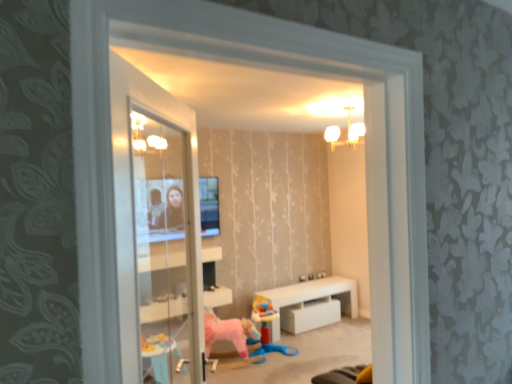
Question: Is white glossy table at center with pink fabric horse at center?

Choices:
 (A) no
 (B) yes

Answer: (A)

Question: Can you confirm if white glossy table at center is wider than pink fabric horse at center?

Choices:
 (A) yes
 (B) no

Answer: (A)

Question: Can you confirm if white glossy table at center is thinner than pink fabric horse at center?

Choices:
 (A) no
 (B) yes

Answer: (A)

Question: Would you say pink fabric horse at center is part of white glossy table at center's contents?

Choices:
 (A) yes
 (B) no

Answer: (B)

Question: Does white glossy table at center lie behind pink fabric horse at center?

Choices:
 (A) no
 (B) yes

Answer: (B)

Question: Is white glossy table at center taller than pink fabric horse at center?

Choices:
 (A) no
 (B) yes

Answer: (A)

Question: Considering the relative sizes of white glossy table at center and plastic blue toy at center in the image provided, is white glossy table at center thinner than plastic blue toy at center?

Choices:
 (A) no
 (B) yes

Answer: (B)

Question: From the image's perspective, does white glossy table at center appear higher than plastic blue toy at center?

Choices:
 (A) no
 (B) yes

Answer: (B)

Question: Is white glossy table at center shorter than plastic blue toy at center?

Choices:
 (A) no
 (B) yes

Answer: (B)

Question: Could you tell me if white glossy table at center is facing plastic blue toy at center?

Choices:
 (A) no
 (B) yes

Answer: (A)

Question: Considering the relative sizes of white glossy table at center and plastic blue toy at center in the image provided, is white glossy table at center bigger than plastic blue toy at center?

Choices:
 (A) yes
 (B) no

Answer: (A)

Question: Is white glossy table at center not within plastic blue toy at center?

Choices:
 (A) yes
 (B) no

Answer: (A)

Question: Is pink fabric horse at center positioned with its back to white glossy table at center?

Choices:
 (A) yes
 (B) no

Answer: (B)